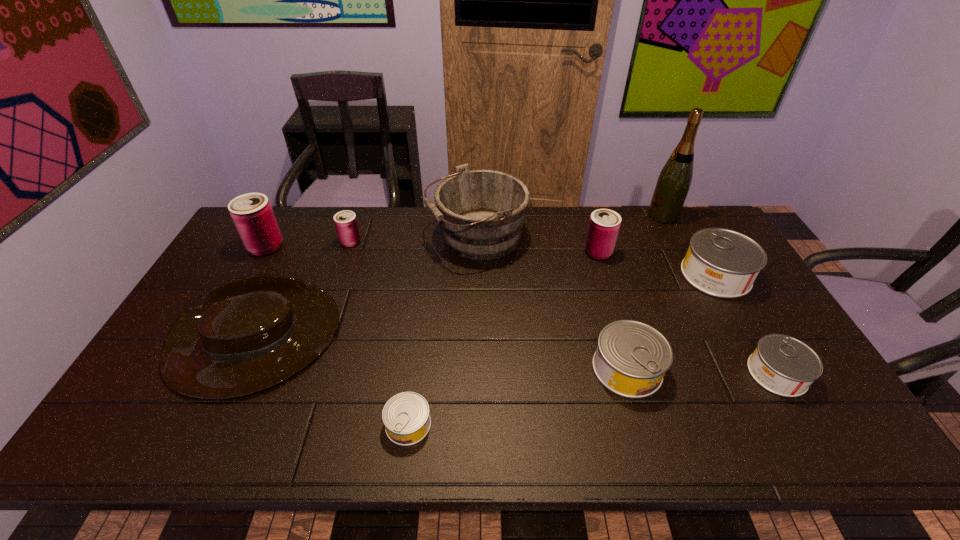
This screenshot has width=960, height=540. I want to click on cowboy hat, so click(x=249, y=334).

Find the location of a particular element. The image size is (960, 540). the third silver can from right to left is located at coordinates (631, 359).

You are a GUI agent. You are given a task and a screenshot of the screen. Output one action in this format:
    pyautogui.click(x=<x>, y=<y>)
    Task: Click on the second smallest silver can
    
    Given the screenshot: What is the action you would take?
    pyautogui.click(x=785, y=366)

This screenshot has width=960, height=540. I want to click on the ninth tallest object, so click(785, 366).

At what (x,y) coordinates should I click in order to perform the action: click on the nearest can. Please return your answer as a coordinate pair (x, y). The image size is (960, 540). Looking at the image, I should click on (406, 416).

Where is `the nearest object`? The image size is (960, 540). the nearest object is located at coordinates (406, 416).

The height and width of the screenshot is (540, 960). Identify the location of vacant space situated on the front-facing side of the tallest object. (611, 215).

Identify the location of vacant point located on the front-facing side of the tallest object. (543, 215).

The image size is (960, 540). In order to click on free space located on the front-facing side of the tallest object in this screenshot , I will do `click(624, 215)`.

Find the location of a particular element. free space located on the front of the wine bucket is located at coordinates (476, 327).